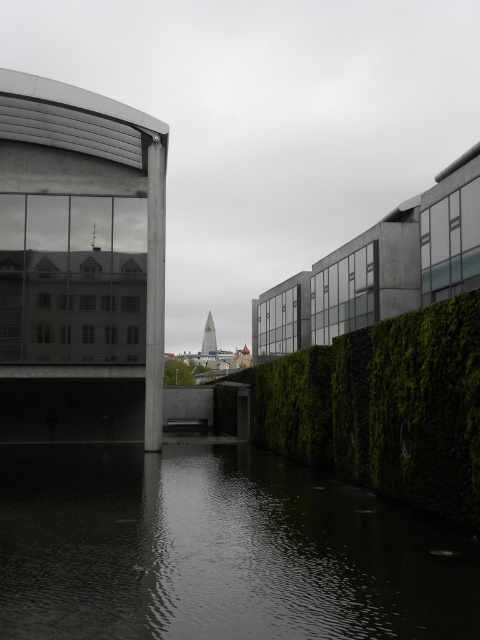
Question: Does dark reflective water at bottom appear on the right side of green mossy hedge at center?

Choices:
 (A) yes
 (B) no

Answer: (B)

Question: Which point is farther from the camera taking this photo?

Choices:
 (A) pos(178,572)
 (B) pos(383,422)

Answer: (B)

Question: Considering the relative positions of dark reflective water at bottom and green mossy hedge at center in the image provided, where is dark reflective water at bottom located with respect to green mossy hedge at center?

Choices:
 (A) left
 (B) right

Answer: (A)

Question: Does dark reflective water at bottom have a larger size compared to green mossy hedge at center?

Choices:
 (A) yes
 (B) no

Answer: (B)

Question: Which point is farther to the camera?

Choices:
 (A) dark reflective water at bottom
 (B) green mossy hedge at center

Answer: (B)